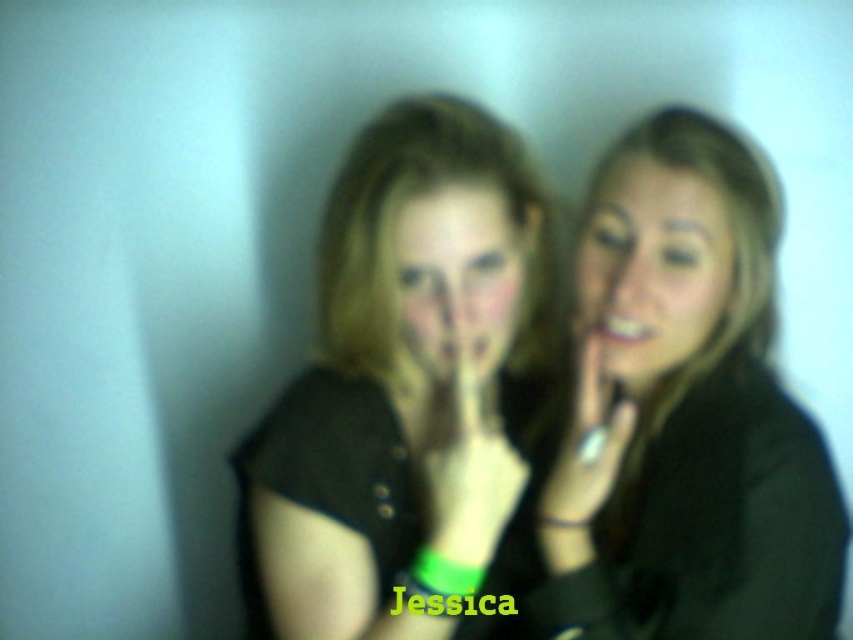
Between matte black shirt at center and matte black face at center, which one is positioned lower?

Positioned lower is matte black shirt at center.

Looking at this image, which of these two, matte black shirt at center or matte black face at center, stands shorter?

matte black face at center

Where is `matte black shirt at center`? The height and width of the screenshot is (640, 853). matte black shirt at center is located at coordinates (409, 392).

Is point (704, 305) positioned behind point (627, 416)?

No, it is in front of (627, 416).

Based on the photo, between smooth skin face at center and smooth skin hand at center, which one appears on the left side from the viewer's perspective?

Positioned to the left is smooth skin hand at center.

Which is behind, point (602, 244) or point (619, 408)?

Point (619, 408)

You are a GUI agent. You are given a task and a screenshot of the screen. Output one action in this format:
    pyautogui.click(x=<x>, y=<y>)
    Task: Click on the smooth skin face at center
    This screenshot has width=853, height=640.
    Given the screenshot: What is the action you would take?
    pyautogui.click(x=653, y=266)

Does smooth black shirt at center have a smaller size compared to green matte hand at center?

No, smooth black shirt at center is not smaller than green matte hand at center.

Is smooth black shirt at center to the right of green matte hand at center from the viewer's perspective?

Correct, you'll find smooth black shirt at center to the right of green matte hand at center.

I want to click on smooth black shirt at center, so click(x=688, y=412).

What are the coordinates of `smooth black shirt at center` in the screenshot? It's located at (688, 412).